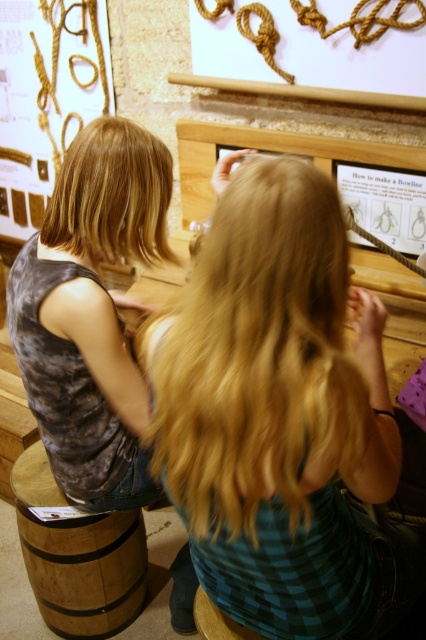
Question: Based on their relative distances, which object is nearer to the wooden stool at lower center?

Choices:
 (A) blonde smooth hair at upper left
 (B) blonde hair at center
 (C) matte gray tank top at left
 (D) wooden barrel at lower left

Answer: (D)

Question: Among these points, which one is nearest to the camera?

Choices:
 (A) (132, 177)
 (B) (83, 224)

Answer: (A)

Question: Does matte gray tank top at left have a lesser width compared to blonde smooth hair at upper left?

Choices:
 (A) yes
 (B) no

Answer: (B)

Question: Does blonde smooth hair at upper left come behind wooden stool at lower center?

Choices:
 (A) no
 (B) yes

Answer: (B)

Question: Which of these objects is positioned closest to the wooden stool at lower center?

Choices:
 (A) blonde smooth hair at upper left
 (B) matte gray tank top at left
 (C) blonde hair at center

Answer: (C)

Question: Is wooden barrel at lower left to the right of wooden stool at lower center from the viewer's perspective?

Choices:
 (A) yes
 (B) no

Answer: (B)